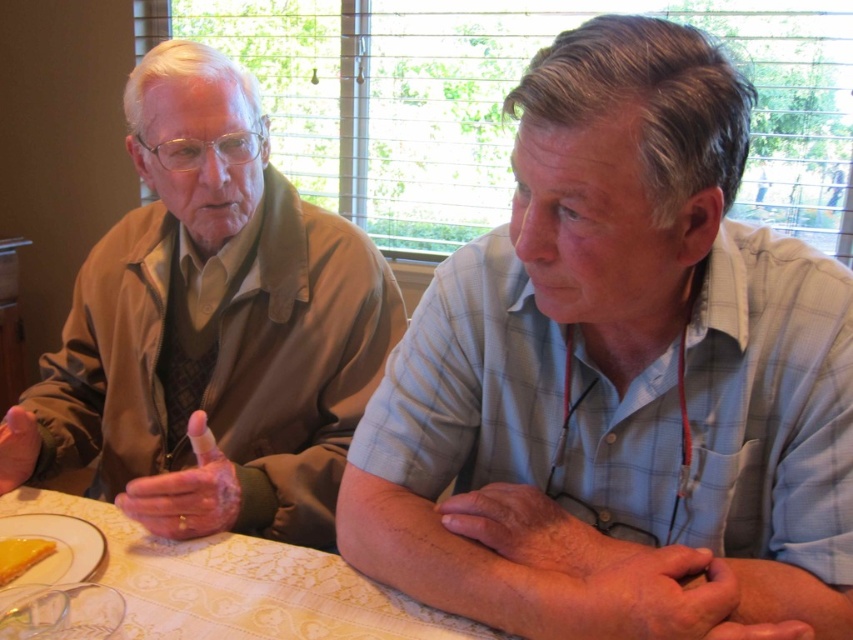
You are a waiter who needs to deliver a dessert to the table. The dessert needs to be placed exactly 60 centimeters away from the light blue plaid shirt at center. Is the yellow creamy cake at lower left currently positioned correctly?

The light blue plaid shirt at center is 59.88 centimeters away from the yellow creamy cake at lower left. Since 59.88 cm is slightly less than 60 cm, the yellow creamy cake at lower left is not positioned correctly and needs to be moved about 0.12 centimeters further away from the light blue plaid shirt at center to meet the requirement.

You are standing in front of the table and want to place a small object on the table. You have two options to choose from where to place it. The first option is at point [721,202] and the second option is at point [184,580]. Which point is closer to you?

Point [721,202] is closer to the viewer than point [184,580], so you should choose the first option.